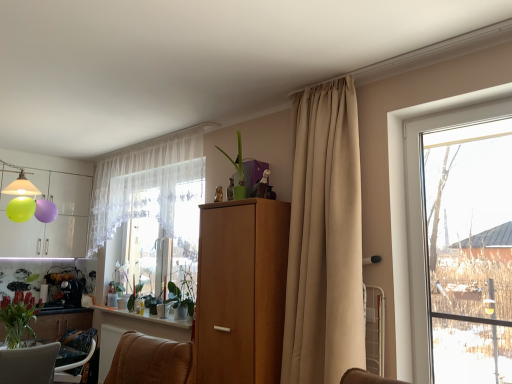
Question: From a real-world perspective, is green matte vase at lower left above or below transparent glass window at right?

Choices:
 (A) below
 (B) above

Answer: (A)

Question: From the image's perspective, is green matte vase at lower left located above or below transparent glass window at right?

Choices:
 (A) above
 (B) below

Answer: (B)

Question: Which of these objects is positioned closest to the transparent glass window at right?

Choices:
 (A) green glossy plant at center, which ranks as the first plant in back-to-front order
 (B) translucent fabric at center
 (C) brown leather armchair at lower center, the first furniture in the back-to-front sequence
 (D) white lace curtain at upper center, which ranks as the first curtain in left-to-right order
 (E) green matte vase at lower left

Answer: (C)

Question: Which of these objects is positioned farthest from the beige fabric curtain at center, which appears as the second curtain when viewed from the left?

Choices:
 (A) green matte plant at lower center, the second plant from the left
 (B) white glossy window sill at lower center
 (C) brown leather armchair at lower center, the first furniture in the back-to-front sequence
 (D) green matte vase at lower left
 (E) matte brown chair at lower left, placed as the first furniture when sorted from front to back

Answer: (D)